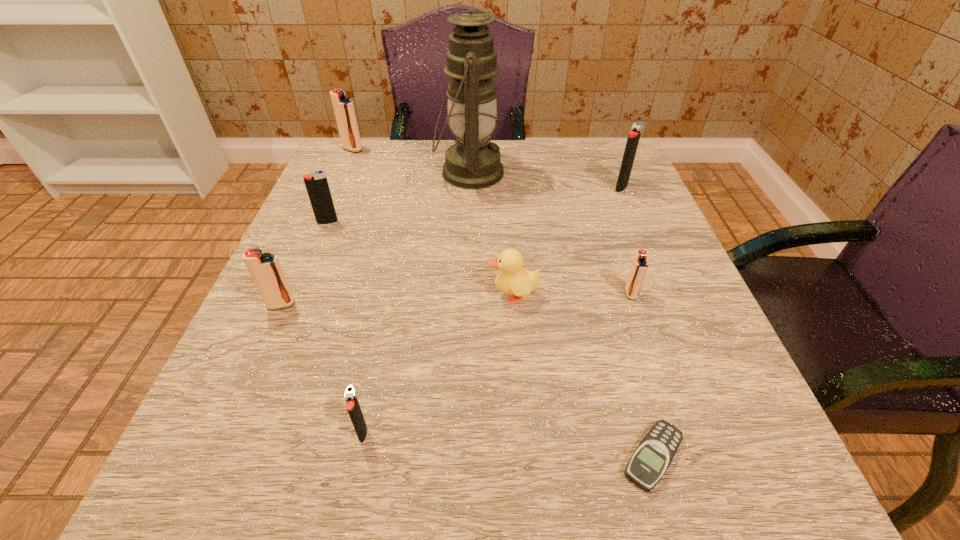
This screenshot has width=960, height=540. In order to click on object located in the far right corner section of the desktop in this screenshot , I will do `click(634, 135)`.

At what (x,y) coordinates should I click in order to perform the action: click on object located at the near right corner. Please return your answer as a coordinate pair (x, y). Looking at the image, I should click on (654, 454).

What are the coordinates of `free location at the far edge` in the screenshot? It's located at pos(396,177).

Where is `vacant space at the near edge`? The width and height of the screenshot is (960, 540). vacant space at the near edge is located at coordinates (343, 482).

At what (x,y) coordinates should I click in order to perform the action: click on vacant space at the left edge of the desktop. Please return your answer as a coordinate pair (x, y). The width and height of the screenshot is (960, 540). Looking at the image, I should click on (340, 196).

In the image, there is a desktop. At what (x,y) coordinates should I click in order to perform the action: click on free space at the right edge. Please return your answer as a coordinate pair (x, y). Looking at the image, I should click on (657, 312).

At what (x,y) coordinates should I click in order to perform the action: click on vacant space at the far left corner of the desktop. Please return your answer as a coordinate pair (x, y). This screenshot has width=960, height=540. Looking at the image, I should click on (333, 152).

Locate an element on the screen. This screenshot has width=960, height=540. free spot at the far right corner of the desktop is located at coordinates (594, 171).

Find the location of a particular element. free space between the second biggest red igniter and the leftmost black igniter is located at coordinates (304, 264).

This screenshot has width=960, height=540. In order to click on vacant point located between the second biggest red igniter and the fourth igniter from left to right in this screenshot , I will do `click(322, 368)`.